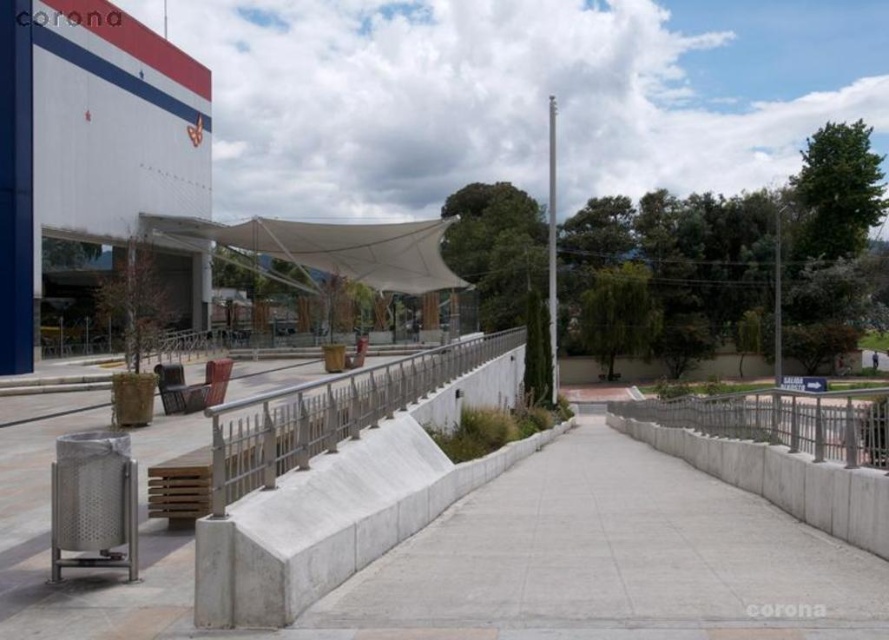
Question: Which point is farther to the camera?

Choices:
 (A) silver metallic rail at center
 (B) white fabric canopy at center
 (C) concrete at center

Answer: (B)

Question: Does concrete at center lie behind silver metallic rail at center?

Choices:
 (A) no
 (B) yes

Answer: (A)

Question: Which point is closer to the camera taking this photo?

Choices:
 (A) tap(369, 227)
 (B) tap(657, 540)
 (C) tap(319, 388)

Answer: (B)

Question: Is silver metallic rail at center thinner than white fabric canopy at center?

Choices:
 (A) yes
 (B) no

Answer: (A)

Question: Which object is the farthest from the white fabric canopy at center?

Choices:
 (A) concrete at center
 (B) silver metallic rail at center

Answer: (A)

Question: Can you confirm if concrete at center is wider than silver metallic rail at center?

Choices:
 (A) no
 (B) yes

Answer: (A)